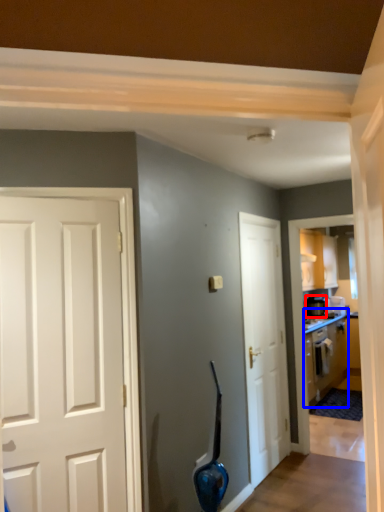
Question: Among these objects, which one is nearest to the camera, appliance (highlighted by a red box) or cabinetry (highlighted by a blue box)?

Choices:
 (A) appliance
 (B) cabinetry

Answer: (B)